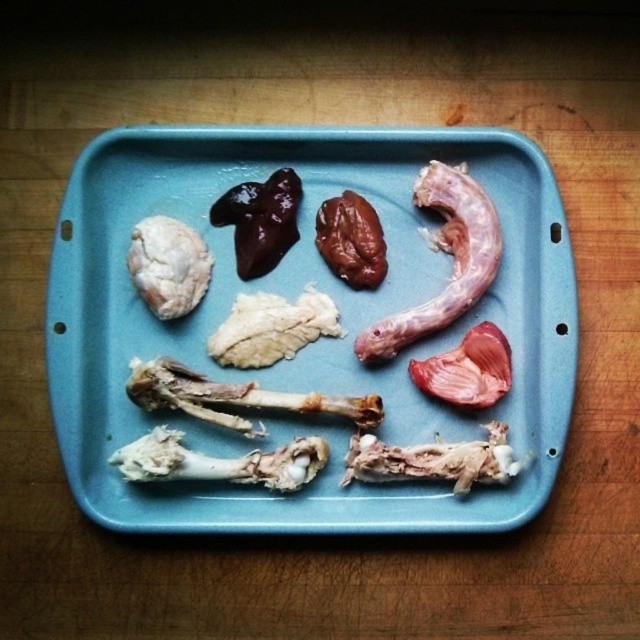
Is white bone at bottom left wider than pink soft tissue at center?

Yes, white bone at bottom left is wider than pink soft tissue at center.

Locate an element on the screen. white bone at bottom left is located at coordinates (220, 461).

Is white fluffy meat at center to the right of white soft heart at upper left from the viewer's perspective?

Yes, white fluffy meat at center is to the right of white soft heart at upper left.

Can you confirm if white fluffy meat at center is bigger than white soft heart at upper left?

Yes, white fluffy meat at center is bigger than white soft heart at upper left.

Between point (316, 305) and point (168, 276), which one is positioned in front?

Point (168, 276) is more forward.

Find the location of a particular element. The height and width of the screenshot is (640, 640). white fluffy meat at center is located at coordinates 272,326.

Can you confirm if white bone at bottom left is smaller than white soft heart at upper left?

No.

Who is more forward, (182,460) or (189,244)?

Positioned in front is point (182,460).

Locate an element on the screen. This screenshot has height=640, width=640. white bone at bottom left is located at coordinates (220, 461).

Where is `white bone at bottom left`? white bone at bottom left is located at coordinates (220, 461).